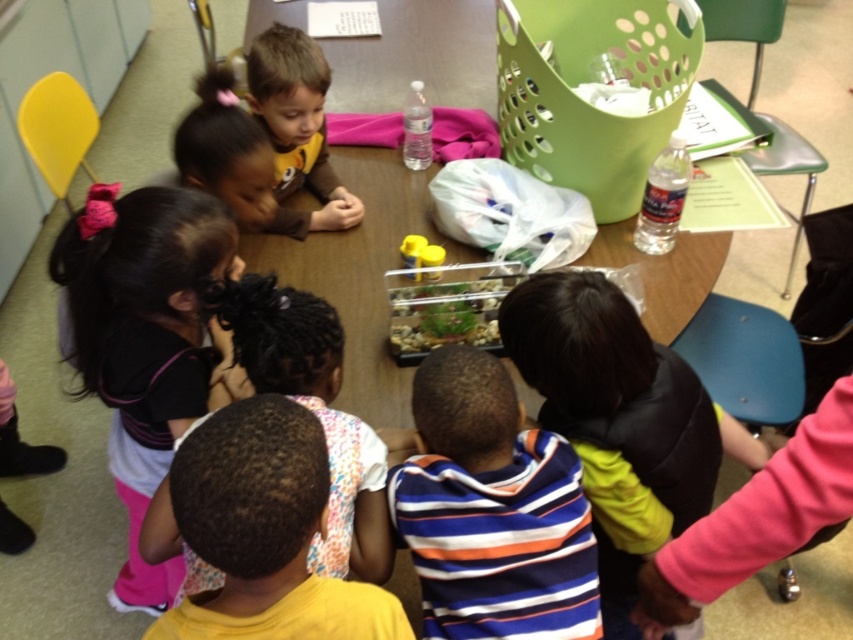
Question: Is pink fabric at lower left closer to camera compared to brown matte shirt at upper center?

Choices:
 (A) yes
 (B) no

Answer: (A)

Question: Does wooden table at center lie behind striped cotton shirt at center?

Choices:
 (A) no
 (B) yes

Answer: (B)

Question: Among these points, which one is nearest to the camera?

Choices:
 (A) (302, 340)
 (B) (498, 276)
 (C) (363, 269)
 (D) (131, 204)

Answer: (A)

Question: Is the position of wooden table at center more distant than that of striped cotton shirt at center?

Choices:
 (A) yes
 (B) no

Answer: (A)

Question: Considering the real-world distances, which object is farthest from the wooden table at center?

Choices:
 (A) dark brown hair at center
 (B) striped cotton shirt at center
 (C) brown matte shirt at upper center
 (D) pink fabric at lower left

Answer: (B)

Question: Which of these objects is positioned closest to the brown matte shirt at upper center?

Choices:
 (A) transparent plastic aquarium at center
 (B) wooden table at center

Answer: (A)